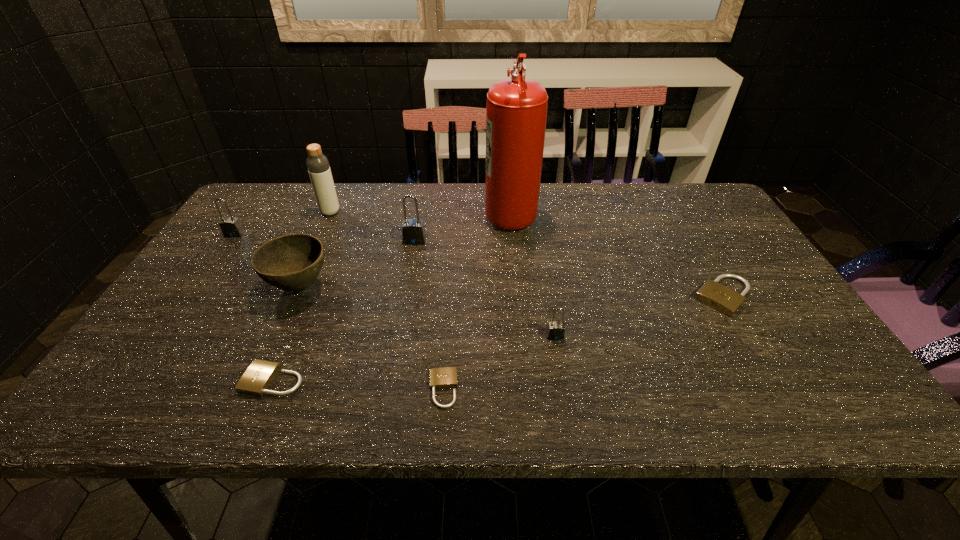
Locate an element on the screen. The image size is (960, 540). padlock that is the closest to the sixth object from left to right is located at coordinates tap(555, 330).

I want to click on padlock object that ranks as the third closest to the second biggest gray padlock, so click(446, 377).

Locate an element on the screen. This screenshot has width=960, height=540. gray padlock object that ranks as the third closest to the eighth shortest object is located at coordinates (555, 330).

Find the location of a particular element. The image size is (960, 540). gray padlock that stands as the second closest to the red fire extinguisher is located at coordinates (555, 330).

Identify which beige padlock is the closest to the rightmost beige padlock. Please provide its 2D coordinates. Your answer should be formatted as a tuple, i.e. [(x, y)], where the tuple contains the x and y coordinates of a point satisfying the conditions above.

[(446, 377)]

Identify which beige padlock is located as the second nearest to the biggest gray padlock. Please provide its 2D coordinates. Your answer should be formatted as a tuple, i.e. [(x, y)], where the tuple contains the x and y coordinates of a point satisfying the conditions above.

[(257, 378)]

The width and height of the screenshot is (960, 540). Find the location of `vacant position in the image that satisfies the following two spatial constraints: 1. on the back side of the second shortest object; 2. on the right side of the fourth nearest padlock`. vacant position in the image that satisfies the following two spatial constraints: 1. on the back side of the second shortest object; 2. on the right side of the fourth nearest padlock is located at coordinates (308, 296).

Where is `vacant space that satisfies the following two spatial constraints: 1. on the shackle of the biggest beige padlock; 2. on the left side of the leftmost padlock`? The width and height of the screenshot is (960, 540). vacant space that satisfies the following two spatial constraints: 1. on the shackle of the biggest beige padlock; 2. on the left side of the leftmost padlock is located at coordinates (191, 296).

I want to click on free space that satisfies the following two spatial constraints: 1. on the shackle of the farthest beige padlock; 2. on the right side of the third tallest object, so click(404, 296).